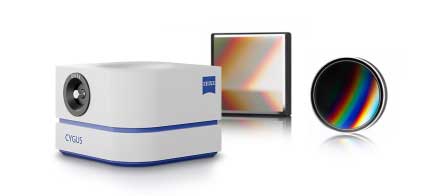
Where is `projector`? Image resolution: width=440 pixels, height=196 pixels. projector is located at coordinates (143, 119).